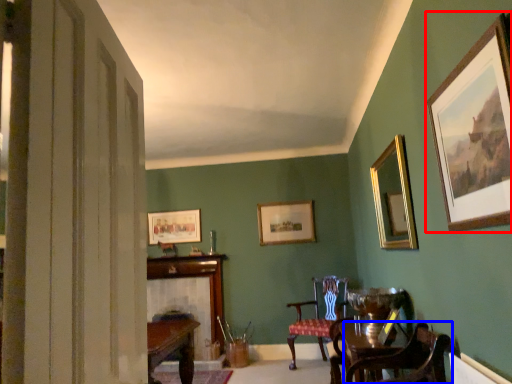
Question: Which of the following is the closest to the observer, picture frame (highlighted by a red box) or chair (highlighted by a blue box)?

Choices:
 (A) picture frame
 (B) chair

Answer: (A)